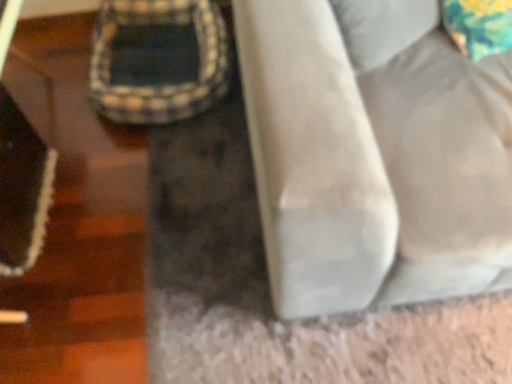
Question: Could suede-like beige couch at lower right be considered to be inside plush beige bean bag at center?

Choices:
 (A) yes
 (B) no

Answer: (B)

Question: Is plush beige bean bag at center not close to suede-like beige couch at lower right?

Choices:
 (A) no
 (B) yes

Answer: (A)

Question: Can we say plush beige bean bag at center lies outside suede-like beige couch at lower right?

Choices:
 (A) yes
 (B) no

Answer: (A)

Question: Is the depth of plush beige bean bag at center less than that of suede-like beige couch at lower right?

Choices:
 (A) no
 (B) yes

Answer: (A)

Question: Does plush beige bean bag at center turn towards suede-like beige couch at lower right?

Choices:
 (A) no
 (B) yes

Answer: (A)

Question: From the image's perspective, would you say plush beige bean bag at center is shown under suede-like beige couch at lower right?

Choices:
 (A) yes
 (B) no

Answer: (B)

Question: From the image's perspective, would you say suede-like beige couch at lower right is positioned over plush beige bean bag at center?

Choices:
 (A) yes
 (B) no

Answer: (B)

Question: Does suede-like beige couch at lower right have a greater height compared to plush beige bean bag at center?

Choices:
 (A) yes
 (B) no

Answer: (A)

Question: Is suede-like beige couch at lower right looking in the opposite direction of plush beige bean bag at center?

Choices:
 (A) yes
 (B) no

Answer: (B)

Question: Is suede-like beige couch at lower right bigger than plush beige bean bag at center?

Choices:
 (A) yes
 (B) no

Answer: (A)

Question: Would you say suede-like beige couch at lower right is a long distance from plush beige bean bag at center?

Choices:
 (A) no
 (B) yes

Answer: (A)

Question: Is plush beige bean bag at center completely or partially inside suede-like beige couch at lower right?

Choices:
 (A) no
 (B) yes

Answer: (A)

Question: Would you say plush beige bean bag at center is to the left or to the right of suede-like beige couch at lower right in the picture?

Choices:
 (A) left
 (B) right

Answer: (A)